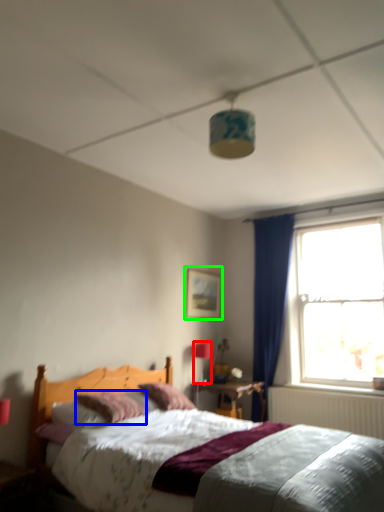
Question: Based on their relative distances, which object is nearer to light fixture (highlighted by a red box)? Choose from pillow (highlighted by a blue box) and picture frame (highlighted by a green box).

Choices:
 (A) pillow
 (B) picture frame

Answer: (B)